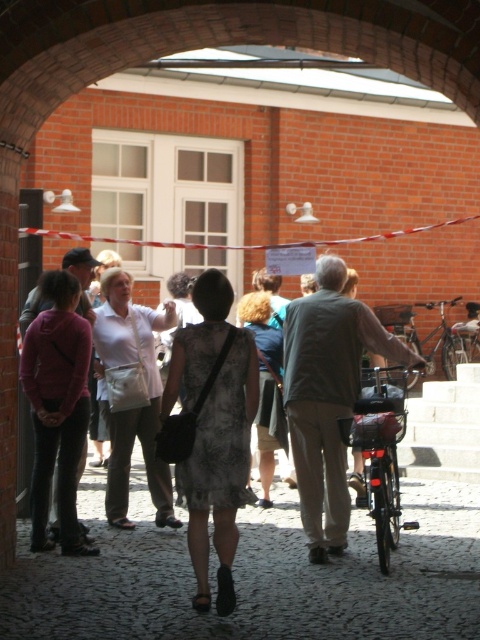
You are a delivery person with a cart that is 2 meters wide. You need to move from the dark gray fabric jacket at center to the concrete staircase at center. Can your cart fit through the space between them?

The distance between the dark gray fabric jacket at center and the concrete staircase at center is 3.32 meters. Since the cart is 2 meters wide, it can fit through the space between them as the distance is wider than the cart.

You are standing at the entrance of the brick building and see both the matte gray dress at center and the shiny metallic bicycle at center. Which object is closer to you?

The matte gray dress at center is closer to you because it is in front of the shiny metallic bicycle at center.

You are trying to decide which outfit takes up more horizontal space in the image. Which of the two items, the matte gray dress at center or the matte pink sweater at left, is wider?

The matte gray dress at center is wider than the matte pink sweater at left according to the description.